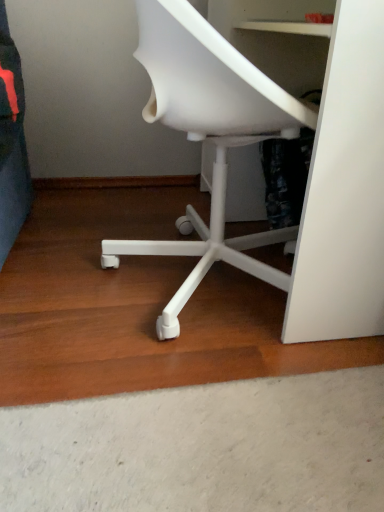
This screenshot has height=512, width=384. Find the location of `white plastic chair at center`. white plastic chair at center is located at coordinates (208, 135).

The height and width of the screenshot is (512, 384). Describe the element at coordinates (208, 135) in the screenshot. I see `white plastic chair at center` at that location.

Where is `white plastic chair at center`? The width and height of the screenshot is (384, 512). white plastic chair at center is located at coordinates (208, 135).